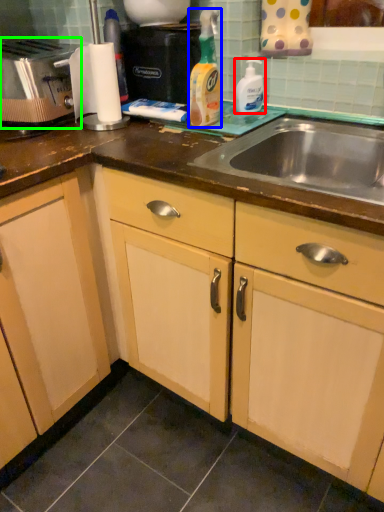
Question: Which object is positioned closest to cleaning product (highlighted by a red box)? Select from cleaning product (highlighted by a blue box) and toaster (highlighted by a green box).

Choices:
 (A) cleaning product
 (B) toaster

Answer: (A)